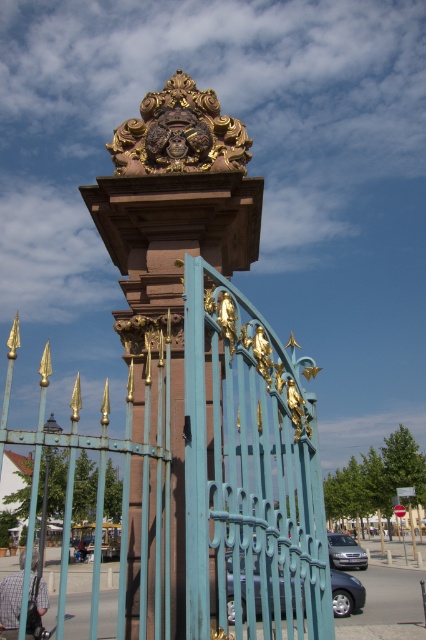
You are a delivery person carrying a box that is 2 meters wide. You need to pass through the space between the polished bronze sculpture at center and the gold ornate sculpture at upper center. Can your box fit through the space between them?

The distance between the polished bronze sculpture at center and the gold ornate sculpture at upper center is 2.35 meters. Since your box is 2 meters wide, it can fit through the space between them as there is enough clearance.

Based on the photo, you are a visitor standing in front of the grand entrance. You notice the teal painted metal gate at center and the polished bronze sculpture at center. Which object is taller?

The polished bronze sculpture at center is taller than the teal painted metal gate at center.